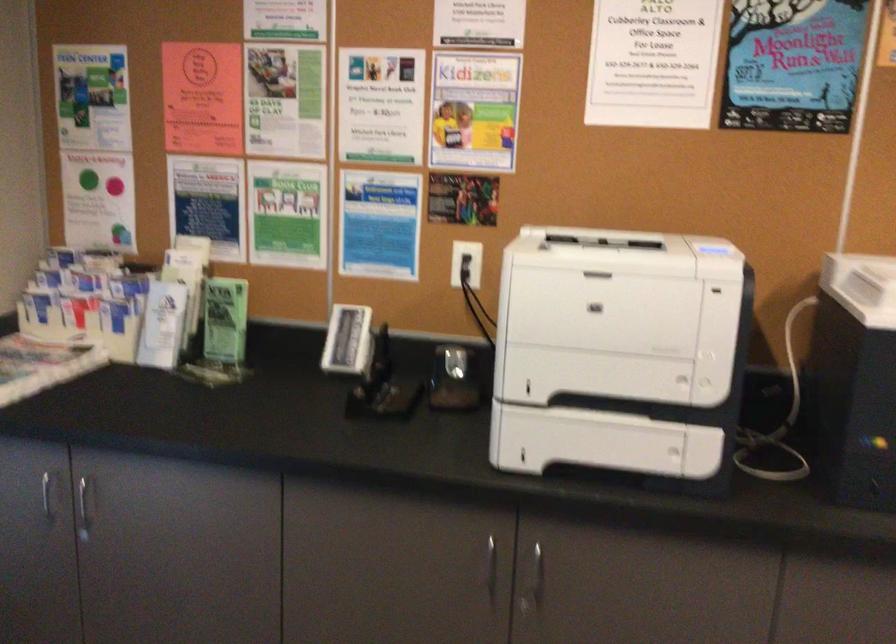
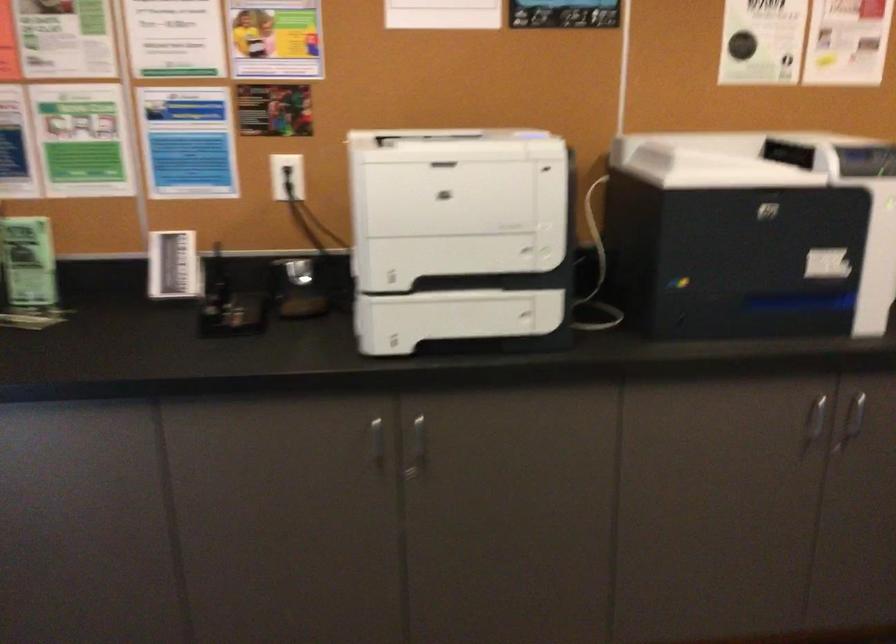
Where in the second image is the point corresponding to (x=532, y=576) from the first image?

(417, 448)